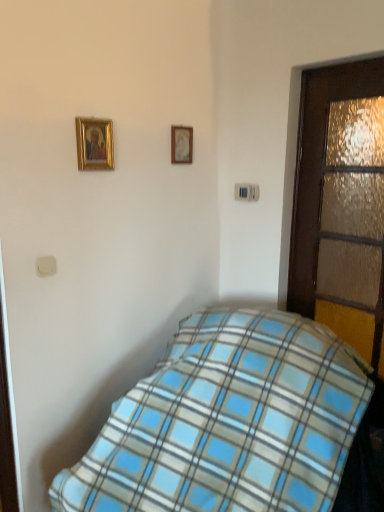
What is the approximate height of wooden textured door at right?

wooden textured door at right is 1.20 meters tall.

The width and height of the screenshot is (384, 512). What do you see at coordinates (229, 422) in the screenshot?
I see `blue plaid blanket at lower center` at bounding box center [229, 422].

Describe the element at coordinates (181, 144) in the screenshot. Image resolution: width=384 pixels, height=512 pixels. I see `wooden picture frame at upper center, which is counted as the 2th picture frame, starting from the front` at that location.

The width and height of the screenshot is (384, 512). What are the coordinates of `wooden textured door at right` in the screenshot? It's located at (341, 205).

From the image's perspective, relative to wooden picture frame at upper center, which appears as the first picture frame when viewed from the right, is wooden textured door at right above or below?

wooden textured door at right is situated lower than wooden picture frame at upper center, which appears as the first picture frame when viewed from the right, in the image.

Considering the sizes of objects wooden textured door at right and wooden picture frame at upper center, which is counted as the 2th picture frame, starting from the front, in the image provided, who is taller, wooden textured door at right or wooden picture frame at upper center, which is counted as the 2th picture frame, starting from the front,?

wooden textured door at right.

From a real-world perspective, does blue plaid blanket at lower center sit lower than gold-framed picture at upper left, the 1th picture frame from the left?

Yes, from a real-world perspective, blue plaid blanket at lower center is below gold-framed picture at upper left, the 1th picture frame from the left.

Considering the relative positions of blue plaid blanket at lower center and gold-framed picture at upper left, the 2th picture frame in the back-to-front sequence, in the image provided, is blue plaid blanket at lower center to the left or to the right of gold-framed picture at upper left, the 2th picture frame in the back-to-front sequence,?

From the image, it's evident that blue plaid blanket at lower center is to the right of gold-framed picture at upper left, the 2th picture frame in the back-to-front sequence.

Does gold-framed picture at upper left, the 1th picture frame viewed from the front, turn towards wooden picture frame at upper center, which appears as the 1th picture frame when viewed from the back?

No, gold-framed picture at upper left, the 1th picture frame viewed from the front, is not facing towards wooden picture frame at upper center, which appears as the 1th picture frame when viewed from the back.

Is gold-framed picture at upper left, the 1th picture frame viewed from the front, to the left of wooden picture frame at upper center, which appears as the first picture frame when viewed from the right, from the viewer's perspective?

Correct, you'll find gold-framed picture at upper left, the 1th picture frame viewed from the front, to the left of wooden picture frame at upper center, which appears as the first picture frame when viewed from the right.

Does point (111, 148) come in front of point (172, 126)?

Yes, it is.

In the scene shown: How different are the orientations of gold-framed picture at upper left, the 1th picture frame from the left, and wooden picture frame at upper center, which appears as the 1th picture frame when viewed from the back, in degrees?

The angle between the facing direction of gold-framed picture at upper left, the 1th picture frame from the left, and the facing direction of wooden picture frame at upper center, which appears as the 1th picture frame when viewed from the back, is 1.12 degrees.

Can you tell me how much wooden picture frame at upper center, marked as the second picture frame in a left-to-right arrangement, and gold-framed picture at upper left, the 2th picture frame in the right-to-left sequence, differ in facing direction?

There is a 1.12-degree angle between the facing directions of wooden picture frame at upper center, marked as the second picture frame in a left-to-right arrangement, and gold-framed picture at upper left, the 2th picture frame in the right-to-left sequence.

Is wooden picture frame at upper center, which is counted as the 2th picture frame, starting from the front, wider than gold-framed picture at upper left, the 2th picture frame in the back-to-front sequence?

No.

Considering the relative positions of wooden picture frame at upper center, marked as the second picture frame in a left-to-right arrangement, and gold-framed picture at upper left, the 2th picture frame in the back-to-front sequence, in the image provided, is wooden picture frame at upper center, marked as the second picture frame in a left-to-right arrangement, behind gold-framed picture at upper left, the 2th picture frame in the back-to-front sequence,?

Yes, wooden picture frame at upper center, marked as the second picture frame in a left-to-right arrangement, is behind gold-framed picture at upper left, the 2th picture frame in the back-to-front sequence.

Is wooden picture frame at upper center, marked as the second picture frame in a left-to-right arrangement, smaller than gold-framed picture at upper left, the 2th picture frame in the right-to-left sequence?

Indeed, wooden picture frame at upper center, marked as the second picture frame in a left-to-right arrangement, has a smaller size compared to gold-framed picture at upper left, the 2th picture frame in the right-to-left sequence.

Is wooden picture frame at upper center, which appears as the first picture frame when viewed from the right, far away from blue plaid blanket at lower center?

Indeed, wooden picture frame at upper center, which appears as the first picture frame when viewed from the right, is not near blue plaid blanket at lower center.

How many degrees apart are the facing directions of wooden picture frame at upper center, which appears as the 1th picture frame when viewed from the back, and blue plaid blanket at lower center?

84.6 degrees separate the facing orientations of wooden picture frame at upper center, which appears as the 1th picture frame when viewed from the back, and blue plaid blanket at lower center.

From a real-world perspective, is wooden picture frame at upper center, marked as the second picture frame in a left-to-right arrangement, physically located above or below blue plaid blanket at lower center?

From a real-world perspective, wooden picture frame at upper center, marked as the second picture frame in a left-to-right arrangement, is physically above blue plaid blanket at lower center.

Is point (176, 127) closer to camera compared to point (181, 496)?

That is False.

From the image's perspective, relative to wooden picture frame at upper center, which is counted as the 2th picture frame, starting from the front, is blue plaid blanket at lower center above or below?

blue plaid blanket at lower center is situated lower than wooden picture frame at upper center, which is counted as the 2th picture frame, starting from the front, in the image.

Which picture frame is the 2nd one when counting from the back of the blue plaid blanket at lower center? Please provide its 2D coordinates.

[(181, 144)]

In the image, is blue plaid blanket at lower center on the left side or the right side of wooden picture frame at upper center, which is counted as the 2th picture frame, starting from the front?

blue plaid blanket at lower center is positioned on wooden picture frame at upper center, which is counted as the 2th picture frame, starting from the front,'s right side.

Is blue plaid blanket at lower center spatially inside wooden picture frame at upper center, which appears as the 1th picture frame when viewed from the back, or outside of it?

blue plaid blanket at lower center is not inside wooden picture frame at upper center, which appears as the 1th picture frame when viewed from the back, it's outside.

The image size is (384, 512). In order to click on bed located below the wooden textured door at right (from the image's perspective) in this screenshot , I will do `click(229, 422)`.

Is point (309, 310) farther from viewer compared to point (208, 409)?

Yes, point (309, 310) is farther from viewer.

Which is more to the right, wooden textured door at right or blue plaid blanket at lower center?

wooden textured door at right is more to the right.

Is wooden textured door at right not near blue plaid blanket at lower center?

No, wooden textured door at right is in close proximity to blue plaid blanket at lower center.

Where is `the 2nd picture frame above when counting from the wooden textured door at right (from the image's perspective)`? the 2nd picture frame above when counting from the wooden textured door at right (from the image's perspective) is located at coordinates (181, 144).

Where is `picture frame that is the 1st object above the blue plaid blanket at lower center (from a real-world perspective)`? picture frame that is the 1st object above the blue plaid blanket at lower center (from a real-world perspective) is located at coordinates (94, 144).

Estimate the real-world distances between objects in this image. Which object is closer to blue plaid blanket at lower center, wooden textured door at right or wooden picture frame at upper center, which appears as the 1th picture frame when viewed from the back?

wooden textured door at right is closer to blue plaid blanket at lower center.

Based on their spatial positions, is wooden picture frame at upper center, marked as the second picture frame in a left-to-right arrangement, or blue plaid blanket at lower center further from gold-framed picture at upper left, the 1th picture frame viewed from the front?

Among the two, blue plaid blanket at lower center is located further to gold-framed picture at upper left, the 1th picture frame viewed from the front.

Based on their spatial positions, is blue plaid blanket at lower center or wooden textured door at right further from wooden picture frame at upper center, which is counted as the 2th picture frame, starting from the front?

Based on the image, blue plaid blanket at lower center appears to be further to wooden picture frame at upper center, which is counted as the 2th picture frame, starting from the front.

Estimate the real-world distances between objects in this image. Which object is further from gold-framed picture at upper left, the 1th picture frame from the left, wooden picture frame at upper center, which appears as the 1th picture frame when viewed from the back, or wooden textured door at right?

Among the two, wooden textured door at right is located further to gold-framed picture at upper left, the 1th picture frame from the left.

Looking at the image, which one is located further to gold-framed picture at upper left, the 1th picture frame viewed from the front, blue plaid blanket at lower center or wooden textured door at right?

blue plaid blanket at lower center lies further to gold-framed picture at upper left, the 1th picture frame viewed from the front, than the other object.

Based on their spatial positions, is gold-framed picture at upper left, the 1th picture frame from the left, or wooden picture frame at upper center, which appears as the 1th picture frame when viewed from the back, closer to wooden textured door at right?

The object closer to wooden textured door at right is wooden picture frame at upper center, which appears as the 1th picture frame when viewed from the back.

When comparing their distances from wooden textured door at right, does wooden picture frame at upper center, marked as the second picture frame in a left-to-right arrangement, or gold-framed picture at upper left, the 1th picture frame viewed from the front, seem further?

The object further to wooden textured door at right is gold-framed picture at upper left, the 1th picture frame viewed from the front.

Based on their spatial positions, is wooden picture frame at upper center, which is counted as the 2th picture frame, starting from the front, or gold-framed picture at upper left, the 1th picture frame viewed from the front, further from blue plaid blanket at lower center?

wooden picture frame at upper center, which is counted as the 2th picture frame, starting from the front, is positioned further to the anchor blue plaid blanket at lower center.

Locate an element on the screen. This screenshot has width=384, height=512. door that lies between gold-framed picture at upper left, the 1th picture frame viewed from the front, and blue plaid blanket at lower center from top to bottom is located at coordinates (341, 205).

Locate an element on the screen. The image size is (384, 512). picture frame between gold-framed picture at upper left, the 2th picture frame in the right-to-left sequence, and wooden textured door at right, in the horizontal direction is located at coordinates (181, 144).

Locate an element on the screen. door between wooden picture frame at upper center, which appears as the 1th picture frame when viewed from the back, and blue plaid blanket at lower center in the up-down direction is located at coordinates (341, 205).

Where is `picture frame that lies between wooden picture frame at upper center, which is counted as the 2th picture frame, starting from the front, and blue plaid blanket at lower center from top to bottom`? This screenshot has height=512, width=384. picture frame that lies between wooden picture frame at upper center, which is counted as the 2th picture frame, starting from the front, and blue plaid blanket at lower center from top to bottom is located at coordinates (94, 144).